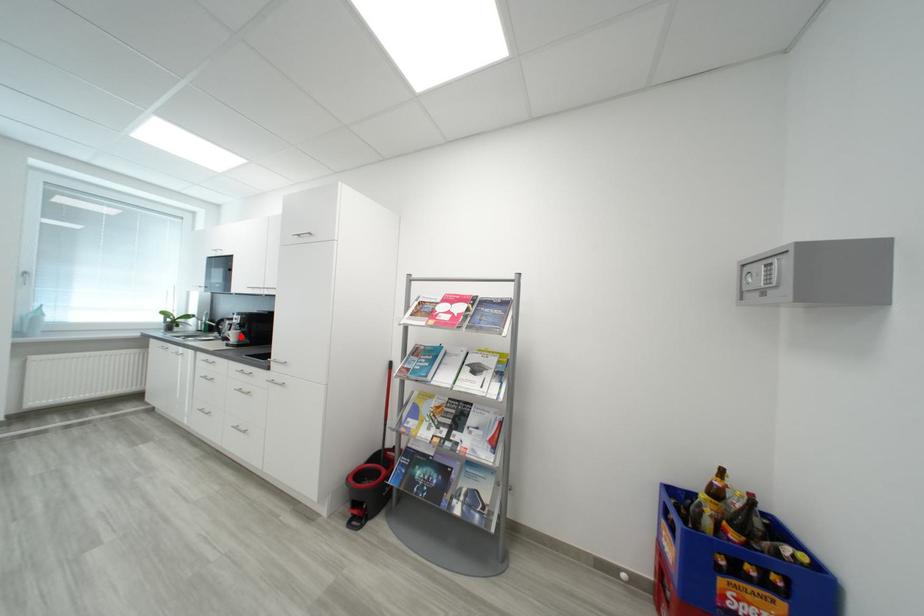
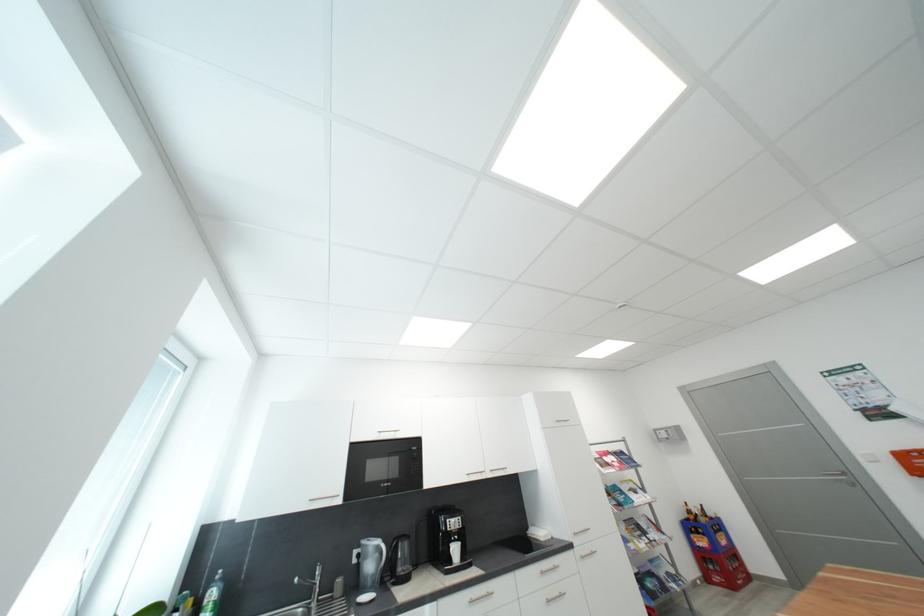
Where in the second image is the point corresponding to the highlighted location from the first image?

(463, 552)